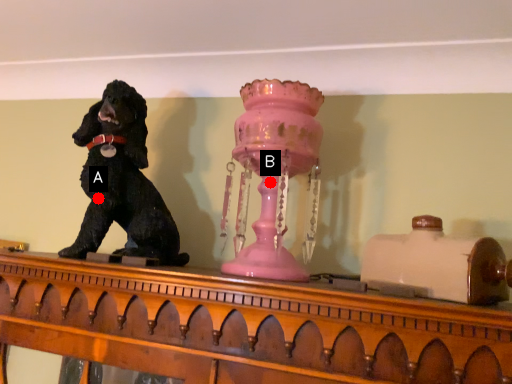
Question: Two points are circled on the image, labeled by A and B beside each circle. Among these points, which one is farthest from the camera?

Choices:
 (A) A is further
 (B) B is further

Answer: (A)